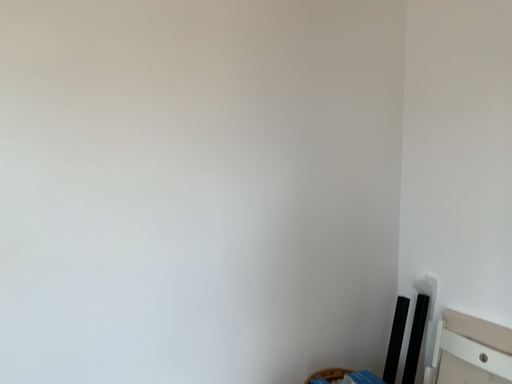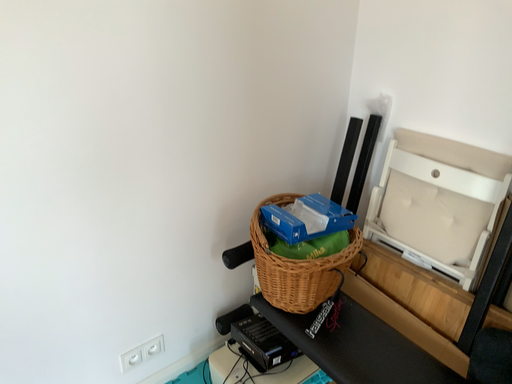
Question: Which way did the camera rotate in the video?

Choices:
 (A) rotated left
 (B) rotated right

Answer: (B)